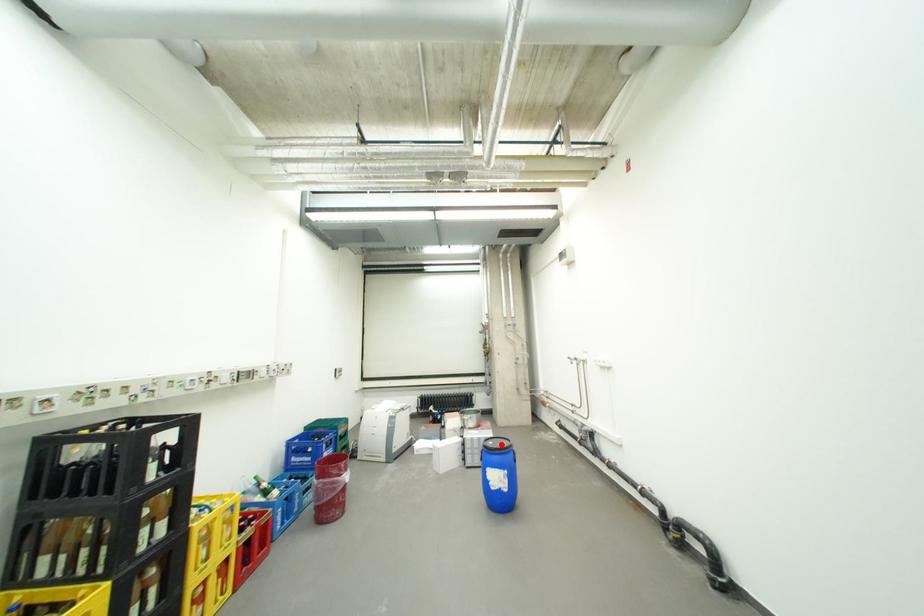
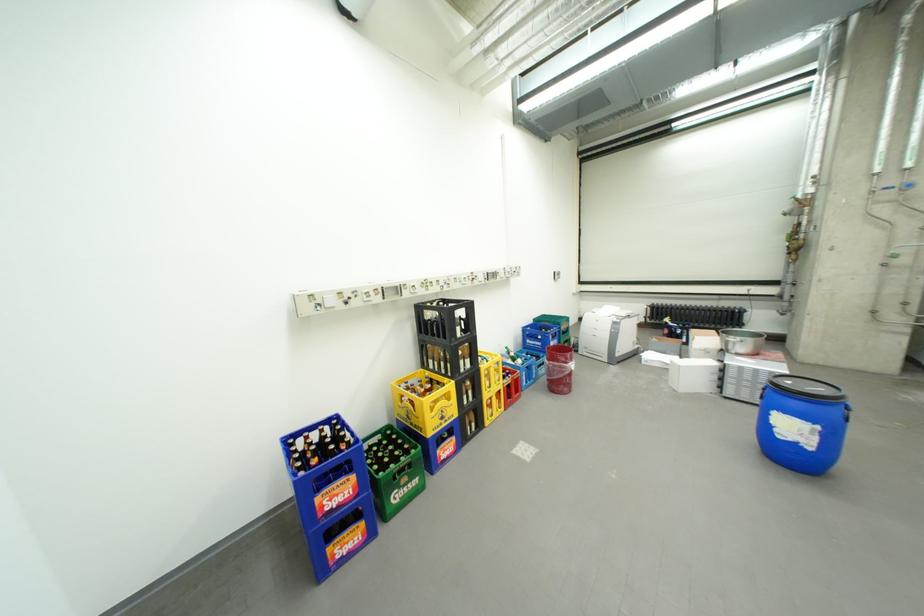
Question: I am providing you with two images of the same scene from different viewpoints. A red point is shown in image1. For the corresponding object point in image2, is it positioned nearer or farther from the camera?

Choices:
 (A) Nearer
 (B) Farther

Answer: (B)